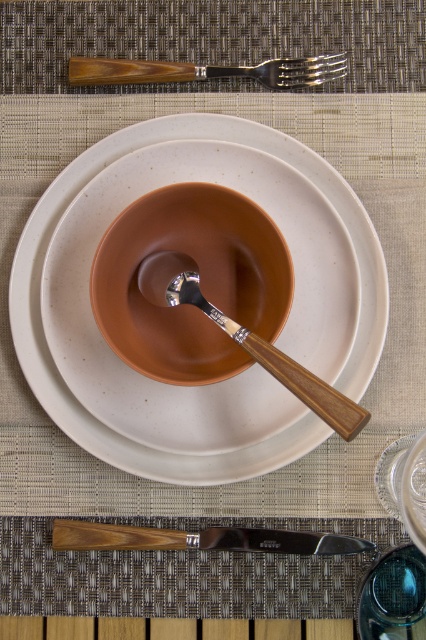
Based on the photo, you are looking at the table setting from above. There are two points marked on the table surface. The first point is at coordinate point (233, 531) and the second is at point (163, 80). Which point is closer to you?

Point (233, 531) is closer to you because it is further to the viewer than point (163, 80).

You are setting up a table for a dinner party and have a matte ceramic platter at center and a polished silver knife at lower center. Which object has a greater width?

The matte ceramic platter at center has a greater width than the polished silver knife at lower center.